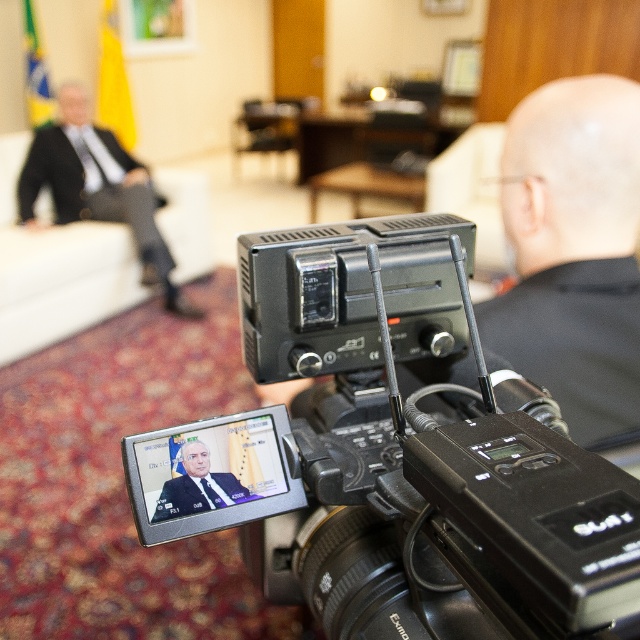
Question: Is black plastic camera at center positioned at the back of dark blue suit at center?

Choices:
 (A) yes
 (B) no

Answer: (B)

Question: Which object appears closest to the camera in this image?

Choices:
 (A) black suit at left
 (B) black plastic camera at center
 (C) bald head at center

Answer: (B)

Question: Is bald head at center positioned in front of black suit at left?

Choices:
 (A) no
 (B) yes

Answer: (B)

Question: Can you confirm if bald head at center is positioned below black suit at left?

Choices:
 (A) no
 (B) yes

Answer: (B)

Question: Which object is farther from the camera taking this photo?

Choices:
 (A) dark blue suit at center
 (B) black suit at left
 (C) bald head at center

Answer: (B)

Question: Estimate the real-world distances between objects in this image. Which object is farther from the black suit at left?

Choices:
 (A) black plastic camera at center
 (B) bald head at center

Answer: (A)